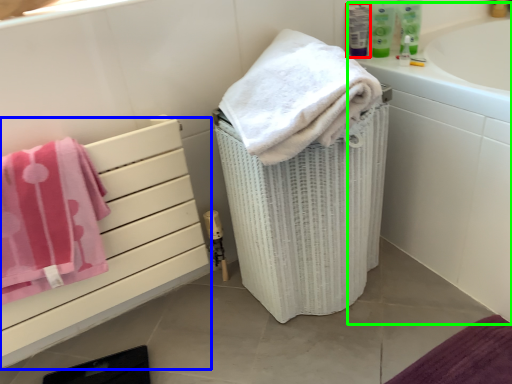
Question: Which object is the farthest from mouthwash (highlighted by a red box)? Choose among these: drawer (highlighted by a blue box) or bath (highlighted by a green box).

Choices:
 (A) drawer
 (B) bath

Answer: (A)